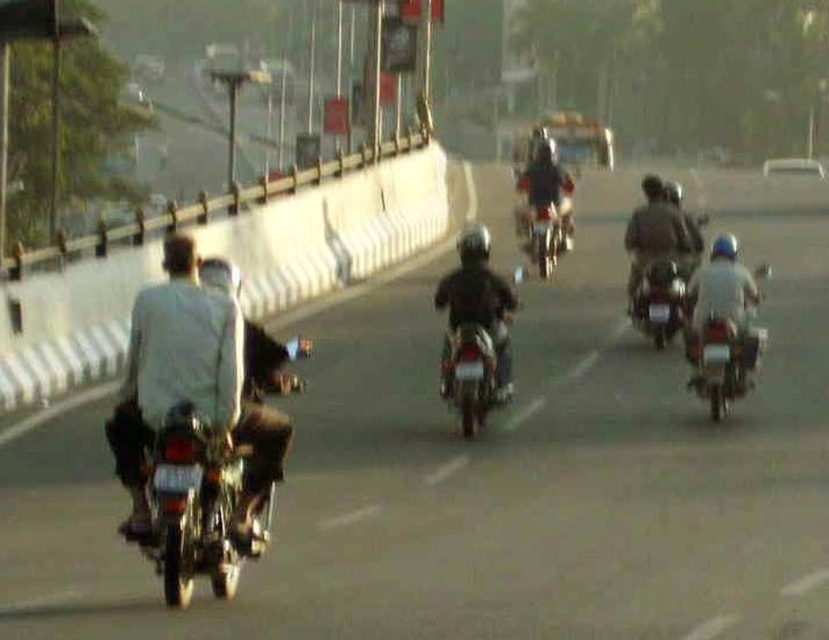
Question: Is light gray fabric shirt at left further to the viewer compared to dark matte jacket at center?

Choices:
 (A) no
 (B) yes

Answer: (A)

Question: Is metallic silver motorcycle at center wider than shiny chrome motorcycle at center?

Choices:
 (A) yes
 (B) no

Answer: (A)

Question: Based on their relative distances, which object is nearer to the dark brown leather jacket at center?

Choices:
 (A) metallic silver motorcycle at center-right
 (B) shiny chrome motorcycle at center
 (C) shiny metallic motorcycle at center

Answer: (A)

Question: Among these points, which one is farthest from the camera?

Choices:
 (A) (655, 291)
 (B) (478, 420)

Answer: (A)

Question: Among these objects, which one is nearest to the camera?

Choices:
 (A) metallic silver motorcycle at right
 (B) light gray fabric shirt at left
 (C) metallic silver motorcycle at center

Answer: (C)

Question: Does metallic silver motorcycle at center appear under metallic silver motorcycle at right?

Choices:
 (A) no
 (B) yes

Answer: (B)